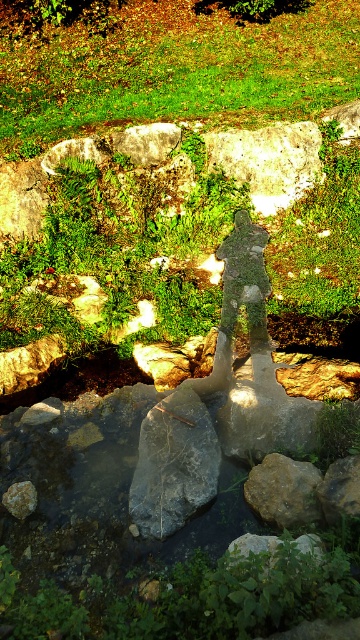
You are a gardener who wants to plant a new flower in the area with the thinnest grass. Which area should you choose between the green leafy grass at center and the green grass at upper center?

The green leafy grass at center is thinner than the green grass at upper center, so you should choose the green leafy grass at center to plant the new flower.